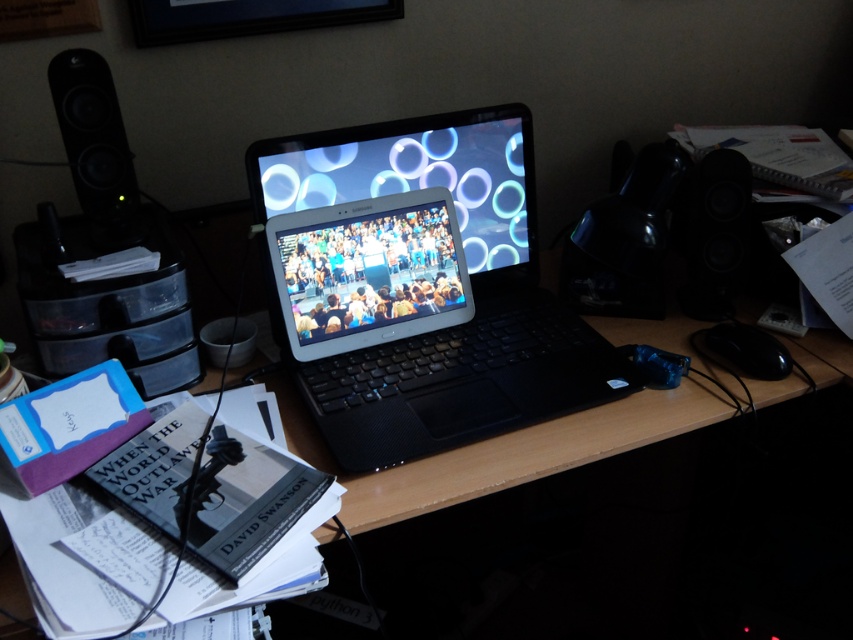
Which is more to the right, black matte laptop at center or black matte speaker at right?

black matte speaker at right is more to the right.

Is point (410, 336) positioned behind point (691, 209)?

No.

Between point (538, 365) and point (700, 180), which one is positioned behind?

The point (700, 180) is behind.

This screenshot has height=640, width=853. In order to click on black matte laptop at center in this screenshot , I will do `click(469, 284)`.

Measure the distance between black matte laptop at center and camera.

The distance of black matte laptop at center from camera is 34.15 inches.

In the scene shown: Who is positioned more to the right, black matte laptop at center or satin black laptop at center?

black matte laptop at center is more to the right.

Where is `black matte laptop at center`? black matte laptop at center is located at coordinates (469, 284).

In order to click on black matte laptop at center in this screenshot , I will do `click(469, 284)`.

Which is more to the left, wooden desk at center or satin silver tablet at center?

From the viewer's perspective, satin silver tablet at center appears more on the left side.

What do you see at coordinates (527, 454) in the screenshot? I see `wooden desk at center` at bounding box center [527, 454].

Is point (788, 396) behind point (387, 288)?

That is False.

Where is `wooden desk at center`? The image size is (853, 640). wooden desk at center is located at coordinates (527, 454).